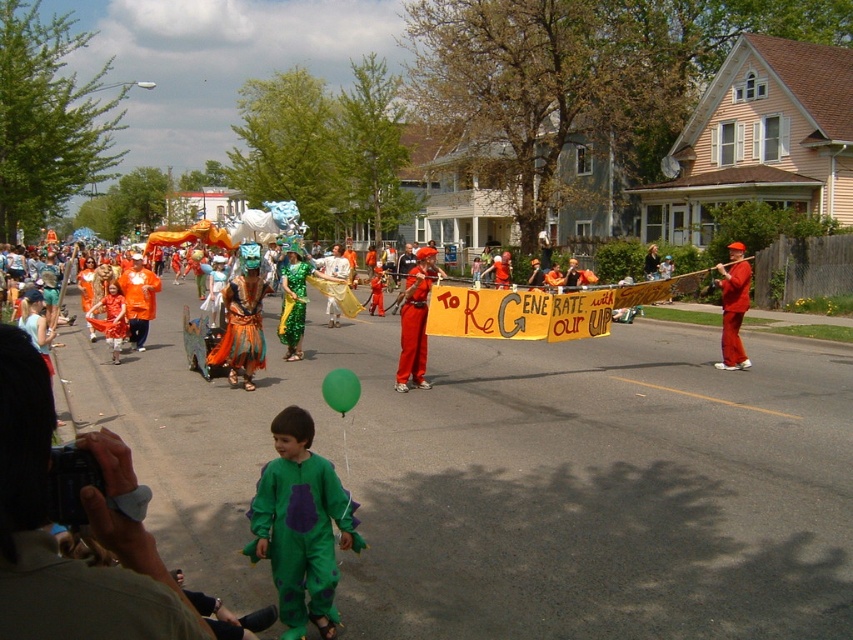
You are a photographer trying to capture the parade scene. You notice the green matte jumpsuit at lower center in your viewfinder. Based on its position, can you estimate whether it will be centered in your photo if you frame the shot using the current composition?

The green matte jumpsuit at lower center is located at point coordinates approximately 0.822 on the x axis and 0.353 on the y axis, which means it is not centered in the frame. To center it, you would need to adjust your camera angle or position to move the subject to the middle of the image.

You are standing at the center of the street and want to take a photo of the green matte jumpsuit at lower center. According to the scene description, where should you aim your camera to capture it?

You should aim your camera at point (x=300, y=525) to capture the green matte jumpsuit at lower center.

You are a photographer trying to capture a photo of the green matte jumpsuit at lower center and the shiny metallic armor at center. The camera can only focus on objects within a 5 meter range. Can you take a photo that includes both subjects without moving your position?

The distance between the green matte jumpsuit at lower center and the shiny metallic armor at center is 6.66 meters, which exceeds the camera focus range of 5 meters. Therefore, you cannot capture both subjects in focus simultaneously without moving your position.